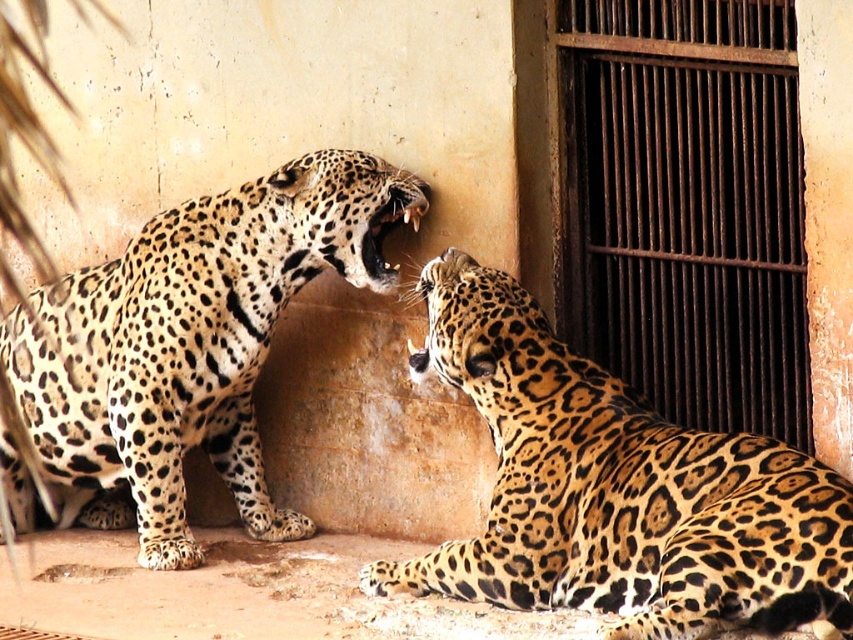
Question: Is the position of spotted fur leopard at lower right less distant than that of spotted fur jaguar at left?

Choices:
 (A) yes
 (B) no

Answer: (A)

Question: Which object appears farthest from the camera in this image?

Choices:
 (A) spotted fur leopard at lower right
 (B) spotted fur jaguar at left

Answer: (B)

Question: Can you confirm if spotted fur leopard at lower right is wider than spotted fur jaguar at left?

Choices:
 (A) no
 (B) yes

Answer: (B)

Question: Among these objects, which one is farthest from the camera?

Choices:
 (A) spotted fur leopard at lower right
 (B) spotted fur jaguar at left

Answer: (B)

Question: Is spotted fur leopard at lower right above spotted fur jaguar at left?

Choices:
 (A) yes
 (B) no

Answer: (A)